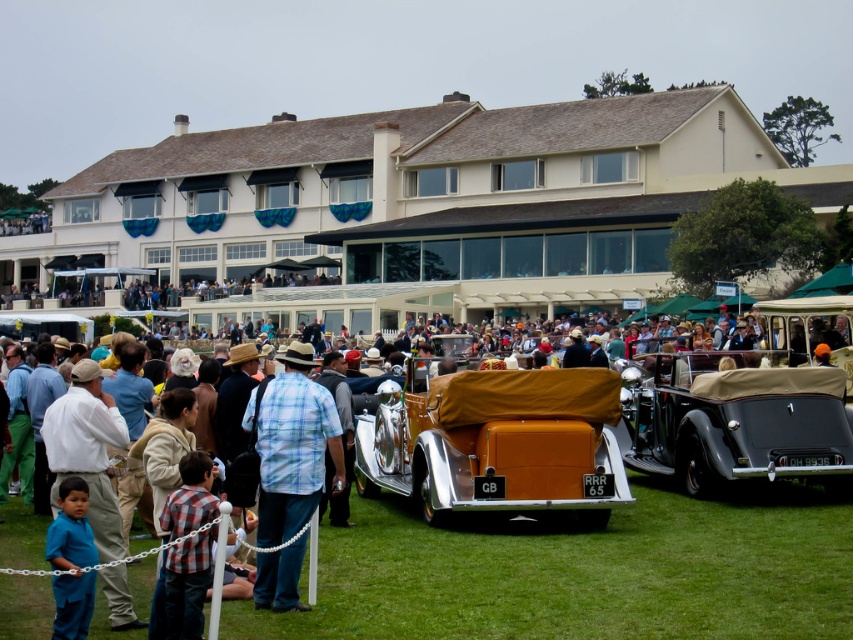
You are organizing a clothing display and need to arrange the plaid shirt at center and the blue cotton shirt at lower left on a rack. If the rack has a width limit of 1.2 meters, can both shirts fit side by side?

The plaid shirt at center might be wider than the blue cotton shirt at lower left, so it is uncertain if both can fit on the rack. Check the exact widths before deciding.

You are at the coordinates 0.5, 0.5 in the image. You want to walk to the gold leather car at center. In which direction should you move?

The gold leather car at center is located at point [496,442]. Since you are at [426,320], you should move northeast to reach it.